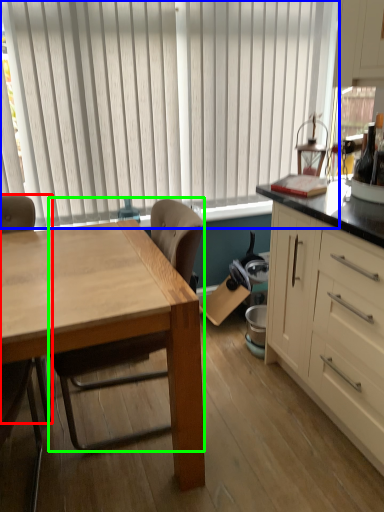
Question: Considering the real-world distances, which object is farthest from chair (highlighted by a red box)? window blind (highlighted by a blue box) or chair (highlighted by a green box)?

Choices:
 (A) window blind
 (B) chair

Answer: (A)